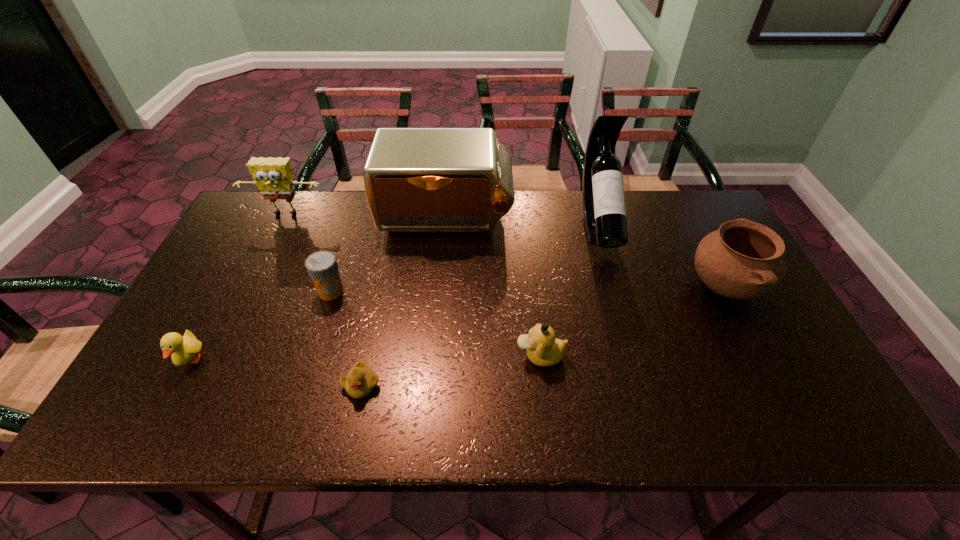
Where is `free space located 0.190m on the stand of the wine bottle`? free space located 0.190m on the stand of the wine bottle is located at coordinates point(624,314).

Locate an element on the screen. vacant region located 0.200m on the door side of the seventh shortest object is located at coordinates (439, 294).

Identify the location of vacant area situated 0.160m on the face of the sponge. (265, 256).

At what (x,y) coordinates should I click in order to perform the action: click on vacant space situated 0.110m on the left of the pottery. Please return your answer as a coordinate pair (x, y). Looking at the image, I should click on (647, 287).

Image resolution: width=960 pixels, height=540 pixels. What are the coordinates of `free spot located on the face of the rightmost duckling` in the screenshot? It's located at (479, 356).

At what (x,y) coordinates should I click in order to perform the action: click on free space located 0.320m on the face of the rightmost duckling. Please return your answer as a coordinate pair (x, y). The height and width of the screenshot is (540, 960). Looking at the image, I should click on (384, 356).

Identify the location of free space located on the face of the rightmost duckling. (491, 356).

What are the coordinates of `free space located on the label side of the medicine` in the screenshot? It's located at (290, 421).

This screenshot has height=540, width=960. I want to click on vacant area situated 0.130m on the front-facing side of the leftmost duckling, so tap(153, 431).

Find the location of `free location located at the beak of the shortest object`. free location located at the beak of the shortest object is located at coordinates (351, 431).